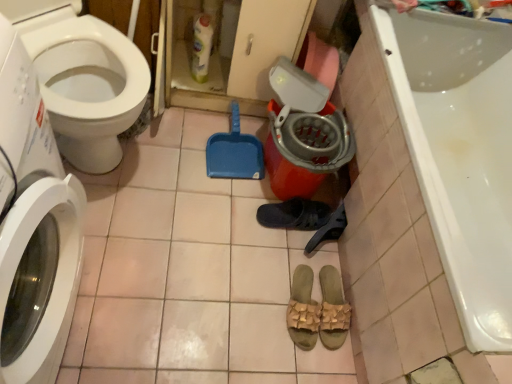
Question: Is translucent plastic bottle at upper center not close to tan woven sandals at center, which is the second footwear from top to bottom?

Choices:
 (A) yes
 (B) no

Answer: (B)

Question: Is translucent plastic bottle at upper center looking in the opposite direction of tan woven sandals at center, which ranks as the 2th footwear in bottom-to-top order?

Choices:
 (A) yes
 (B) no

Answer: (B)

Question: Considering the relative sizes of translucent plastic bottle at upper center and tan woven sandals at center, which is the second footwear from top to bottom, in the image provided, is translucent plastic bottle at upper center shorter than tan woven sandals at center, which is the second footwear from top to bottom,?

Choices:
 (A) yes
 (B) no

Answer: (B)

Question: Is translucent plastic bottle at upper center located outside tan woven sandals at center, which is the second footwear from top to bottom?

Choices:
 (A) no
 (B) yes

Answer: (B)

Question: Are translucent plastic bottle at upper center and tan woven sandals at center, which is the second footwear from top to bottom, making contact?

Choices:
 (A) yes
 (B) no

Answer: (B)

Question: Considering the relative positions of translucent plastic bottle at upper center and tan woven sandals at center, which ranks as the 2th footwear in bottom-to-top order, in the image provided, is translucent plastic bottle at upper center behind tan woven sandals at center, which ranks as the 2th footwear in bottom-to-top order,?

Choices:
 (A) no
 (B) yes

Answer: (B)

Question: Is dark gray fabric slipper at center, the 1th footwear in the top-to-bottom sequence, smaller than tan woven sandals at center, the first footwear when ordered from bottom to top?

Choices:
 (A) yes
 (B) no

Answer: (B)

Question: Is tan woven sandals at center, the first footwear when ordered from bottom to top, a part of dark gray fabric slipper at center, which is counted as the 3th footwear, starting from the bottom?

Choices:
 (A) yes
 (B) no

Answer: (B)

Question: Is dark gray fabric slipper at center, the 1th footwear in the top-to-bottom sequence, shorter than tan woven sandals at center, the first footwear when ordered from bottom to top?

Choices:
 (A) no
 (B) yes

Answer: (B)

Question: Does dark gray fabric slipper at center, which is counted as the 3th footwear, starting from the bottom, have a lesser width compared to tan woven sandals at center, marked as the 3th footwear in a top-to-bottom arrangement?

Choices:
 (A) no
 (B) yes

Answer: (B)

Question: Is dark gray fabric slipper at center, the 1th footwear in the top-to-bottom sequence, to the right of tan woven sandals at center, the first footwear when ordered from bottom to top, from the viewer's perspective?

Choices:
 (A) no
 (B) yes

Answer: (A)

Question: Can you confirm if dark gray fabric slipper at center, which is counted as the 3th footwear, starting from the bottom, is wider than tan woven sandals at center, marked as the 3th footwear in a top-to-bottom arrangement?

Choices:
 (A) no
 (B) yes

Answer: (A)

Question: Is white glossy toilet at left wider than tan woven sandals at center, the first footwear when ordered from bottom to top?

Choices:
 (A) no
 (B) yes

Answer: (B)